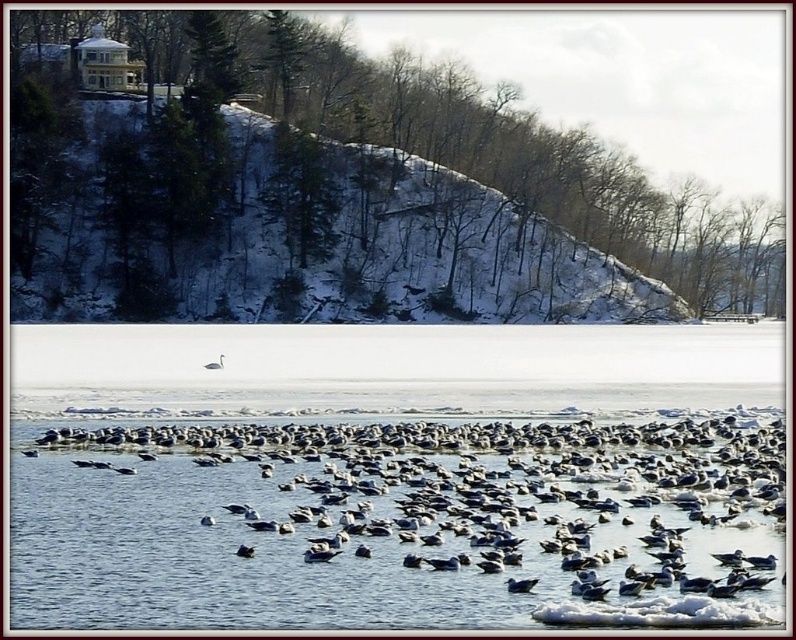
Who is more forward, (215, 364) or (201, 522)?

Point (201, 522) is more forward.

Is white matte swan at center above white matte duck at center?

Correct, white matte swan at center is located above white matte duck at center.

Where is `white matte swan at center`? The image size is (796, 640). white matte swan at center is located at coordinates (215, 364).

At what (x,y) coordinates should I click in order to perform the action: click on white matte swan at center. Please return your answer as a coordinate pair (x, y). The width and height of the screenshot is (796, 640). Looking at the image, I should click on pos(215,364).

Which of these two, white matte seagulls at center or white matte swan at center, stands shorter?

white matte swan at center is shorter.

Which is behind, point (679, 577) or point (219, 360)?

The point (219, 360) is behind.

Where is `white matte seagulls at center`? white matte seagulls at center is located at coordinates (422, 492).

Can you confirm if white matte seagulls at center is positioned below white matte bird at center?

No.

Which is more to the left, white matte seagulls at center or white matte bird at center?

white matte seagulls at center

This screenshot has width=796, height=640. Describe the element at coordinates (422, 492) in the screenshot. I see `white matte seagulls at center` at that location.

The image size is (796, 640). I want to click on white matte seagulls at center, so click(422, 492).